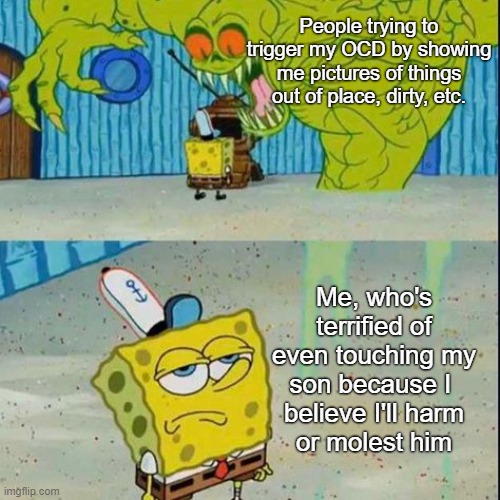
Find the location of a particular element. door is located at coordinates (13, 158).